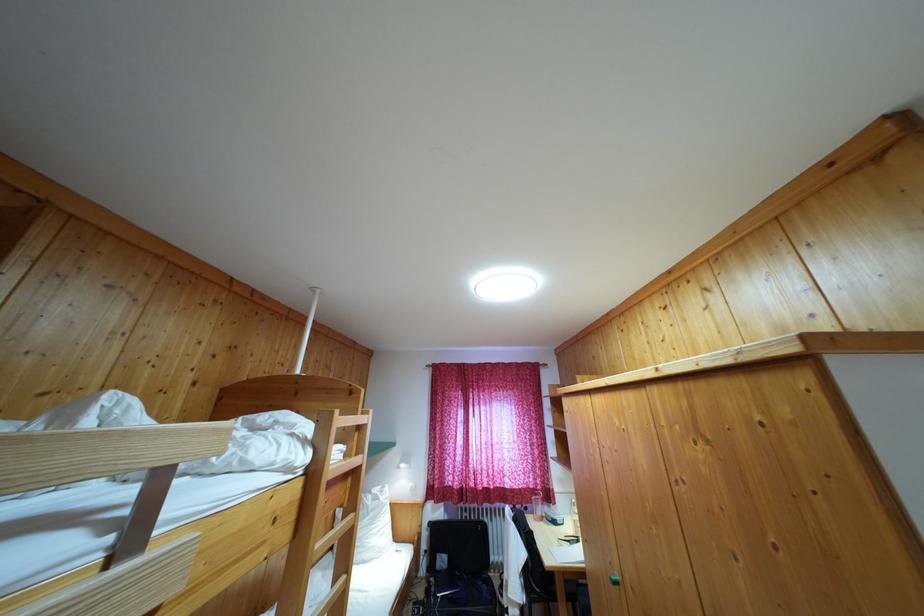
You are a GUI agent. You are given a task and a screenshot of the screen. Output one action in this format:
    pyautogui.click(x=<x>, y=<y>)
    Task: Click on the small green knob
    The width and height of the screenshot is (924, 616).
    Given the screenshot: What is the action you would take?
    pyautogui.click(x=614, y=578)